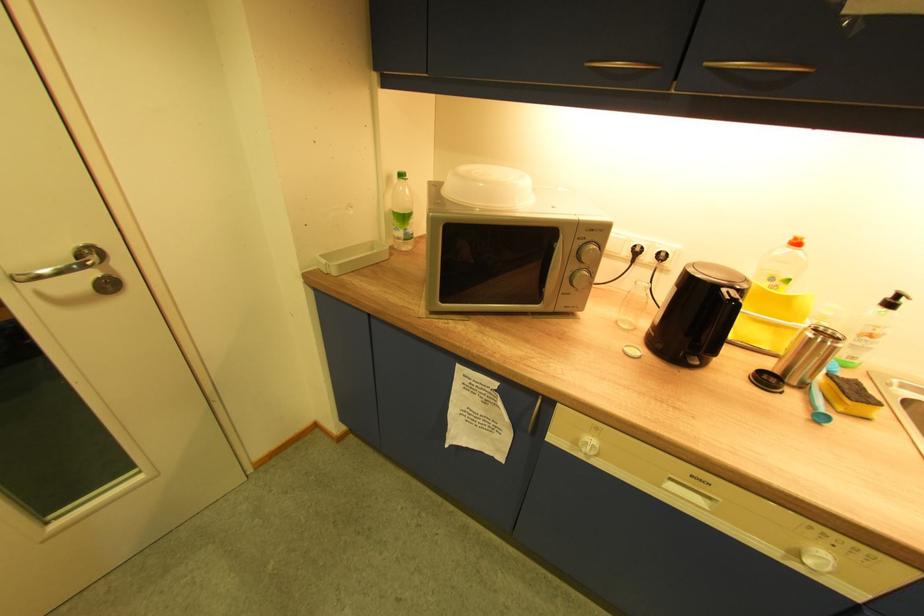
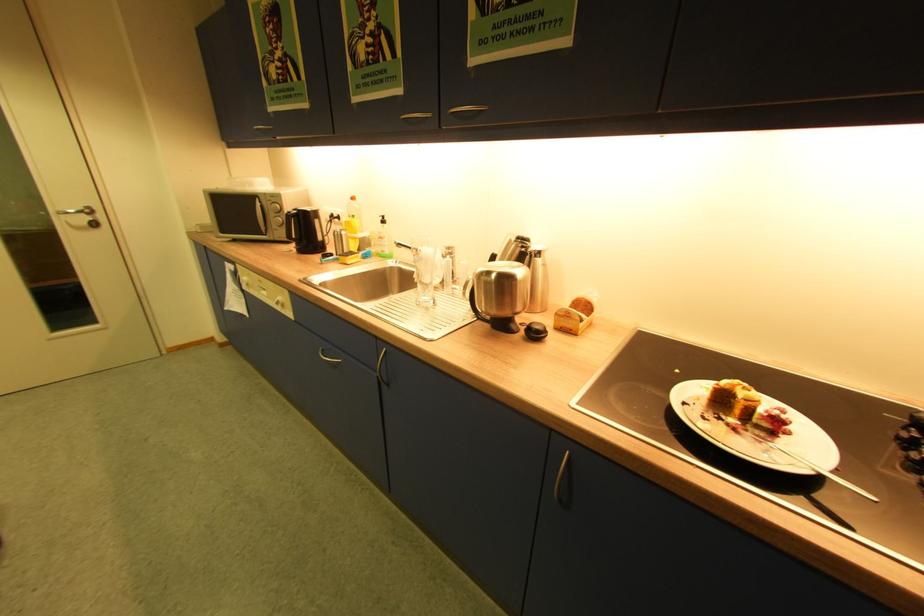
Where in the second image is the point corresponding to point (45, 296) from the first image?

(74, 224)